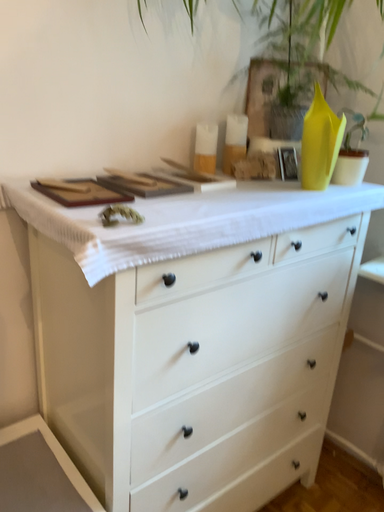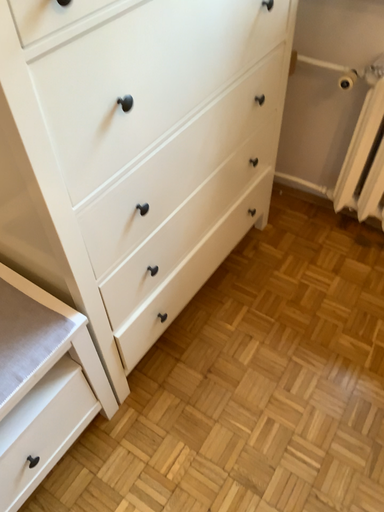
Question: Which way did the camera rotate in the video?

Choices:
 (A) rotated right
 (B) rotated left

Answer: (A)